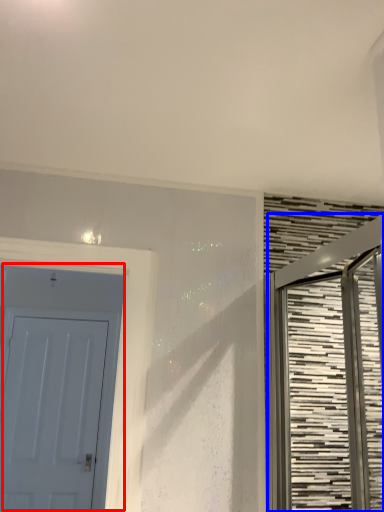
Question: Which object is closer to the camera taking this photo, door (highlighted by a red box) or door (highlighted by a blue box)?

Choices:
 (A) door
 (B) door

Answer: (B)